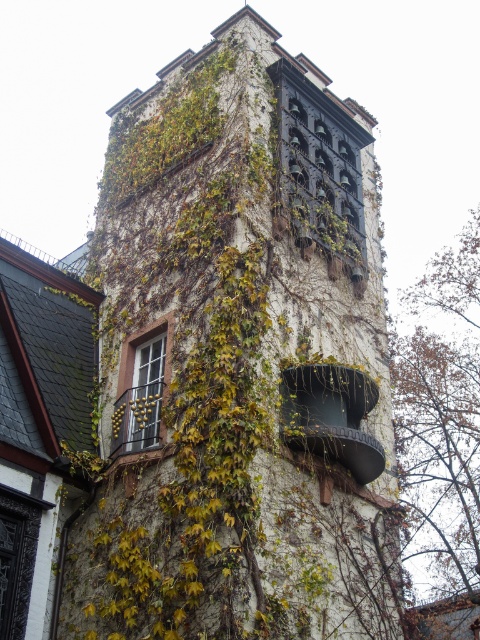
Question: Does brown bark tree at right have a greater width compared to matte glass window at center-left?

Choices:
 (A) no
 (B) yes

Answer: (B)

Question: Is brown bark tree at right wider than matte glass window at center-left?

Choices:
 (A) no
 (B) yes

Answer: (B)

Question: Which object is closer to the camera taking this photo?

Choices:
 (A) brown bark tree at right
 (B) matte glass window at center-left

Answer: (B)

Question: Which object appears farthest from the camera in this image?

Choices:
 (A) matte glass window at center-left
 (B) brown bark tree at right

Answer: (B)

Question: Is brown bark tree at right bigger than matte glass window at center-left?

Choices:
 (A) yes
 (B) no

Answer: (A)